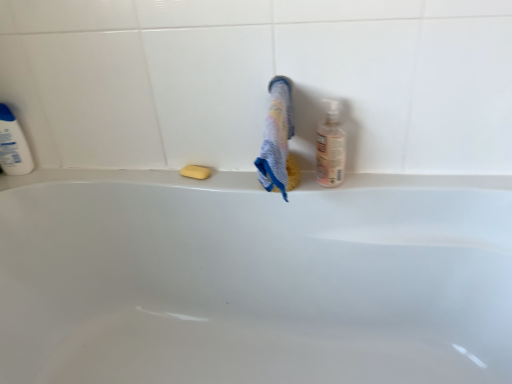
What are the coordinates of `vacant area located to the right-hand side of yellow matte soap at center` in the screenshot? It's located at (242, 176).